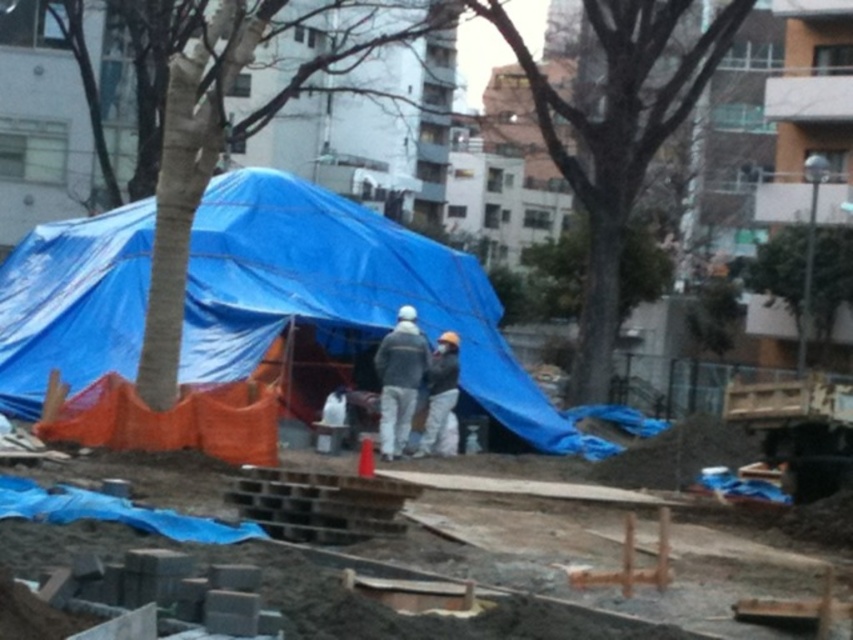
You are a safety inspector observing the construction site. You notice two gray fabric items at the center of the scene. Which one is closer to you, the gray fabric jacket at center or the gray fabric worker at center?

The gray fabric jacket at center is closer to you because it is in front of the gray fabric worker at center.

You are a safety inspector at the construction site. You notice the blue tarpaulin tent at center and the green leafy tree at upper center. Which object is positioned higher in the image?

The green leafy tree at upper center is positioned higher than the blue tarpaulin tent at center.

Based on the scene, can you determine if the blue tarpaulin tent at center is wider than the green leafy tree at upper center?

The blue tarpaulin tent at center is wider than the green leafy tree at upper center according to the description.